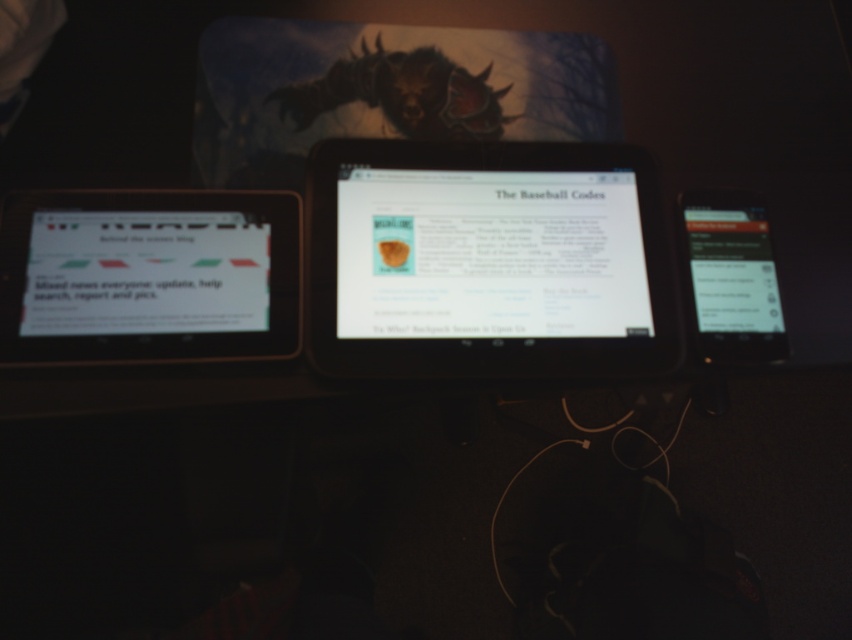
You are standing in front of the desk where the white glossy tablet at center is placed. If you want to reach the tablet, which direction should you move your hand from your current position?

The white glossy tablet at center is located at point (488, 253), so you should move your hand towards the center of the desk to reach it.

You are organizing a tech fair and need to place a label next to the white glossy tablet at left and the black glossy tablet at right. The label must be placed on the side that faces the visitor. Since the tablets are side by side, which tablet requires a wider label to accommodate its larger size?

The white glossy tablet at left requires a wider label because it is larger in size than the black glossy tablet at right.

You are organizing a presentation and need to adjust the positions of the white glossy tablet at center and the white glossy tablet at left. From the viewer perspective, which tablet should you move forward to ensure the central tablet is in front?

The white glossy tablet at left is behind the white glossy tablet at center, so you should move the white glossy tablet at left forward to ensure the central tablet remains in front.